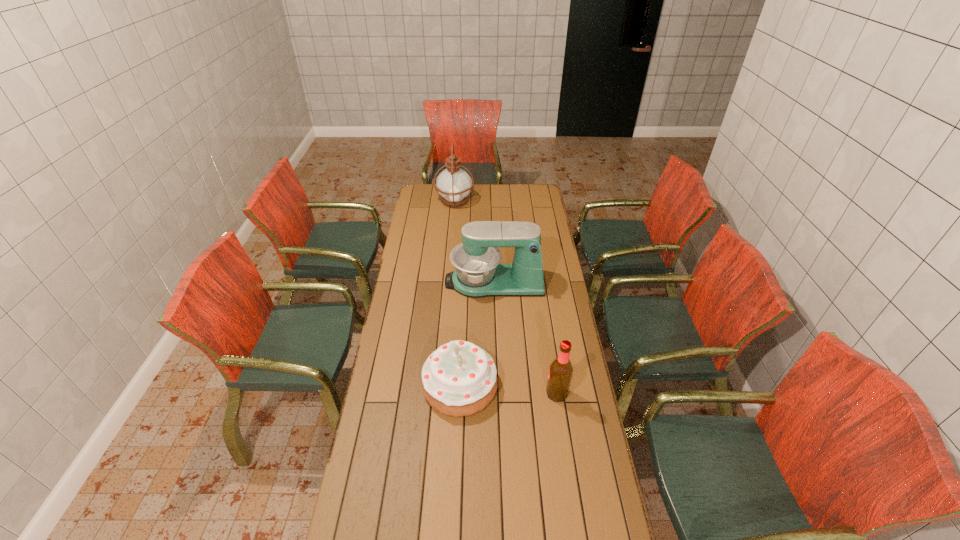
This screenshot has height=540, width=960. I want to click on free point located on the front of the cake, so click(455, 512).

Image resolution: width=960 pixels, height=540 pixels. Find the location of `object that is at the far edge`. object that is at the far edge is located at coordinates (453, 184).

At what (x,y) coordinates should I click in order to perform the action: click on object that is at the left edge. Please return your answer as a coordinate pair (x, y). The image size is (960, 540). Looking at the image, I should click on (453, 184).

Find the location of `mixer present at the right edge`. mixer present at the right edge is located at coordinates (477, 274).

In order to click on beer bottle present at the right edge in this screenshot , I will do `click(560, 373)`.

You are a GUI agent. You are given a task and a screenshot of the screen. Output one action in this format:
    pyautogui.click(x=<x>, y=<y>)
    Task: Click on the object situated at the far left corner
    This screenshot has height=540, width=960.
    Given the screenshot: What is the action you would take?
    pyautogui.click(x=453, y=184)

In the image, there is a desktop. At what (x,y) coordinates should I click in order to perform the action: click on free space at the left edge. Please return your answer as a coordinate pair (x, y). This screenshot has height=540, width=960. Looking at the image, I should click on (410, 336).

The image size is (960, 540). Identify the location of free location at the right edge of the desktop. (567, 472).

The height and width of the screenshot is (540, 960). In the image, there is a desktop. Identify the location of vacant area at the far left corner. (419, 186).

Locate an element on the screen. This screenshot has height=540, width=960. free spot between the shortest object and the beer bottle is located at coordinates (509, 389).